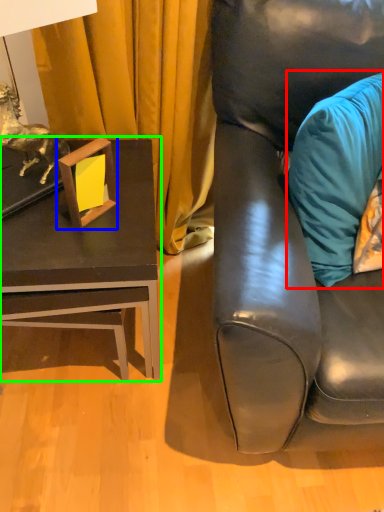
Question: Which object is positioned closest to pillow (highlighted by a red box)? Select from picture frame (highlighted by a blue box) and table (highlighted by a green box).

Choices:
 (A) picture frame
 (B) table

Answer: (B)